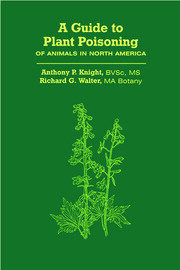
Identify the location of plant. This screenshot has height=270, width=180. (58, 43).